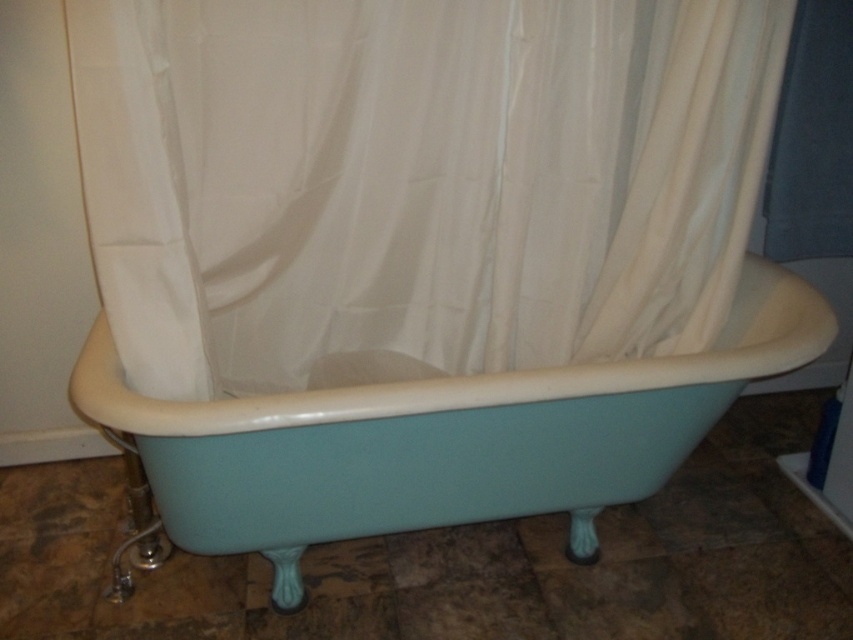
You are standing in a bathroom with a vintage clawfoot bathtub. You notice a specific point marked at coordinates point (248, 72). If you want to take a photo of this point from where you are standing, will the camera be close enough to capture it clearly?

The point (248, 72) and the camera are 5.01 feet apart. Since 5.01 feet is a reasonable distance for capturing details, the camera can clearly capture the point from that distance.

You are standing in the bathroom and want to place a small plant between the two points marked as point (692, 193) and point (360, 536). Since the plant needs to be closer to you, which point should you position it near?

You should position the plant near point (692, 193) because it is closer to you compared to point (360, 536).

You are standing in the bathroom and want to locate the white fabric shower curtain at center. According to the image, where is the shower curtain positioned in terms of its coordinates?

The white fabric shower curtain at center is located at the coordinates point (416, 179).